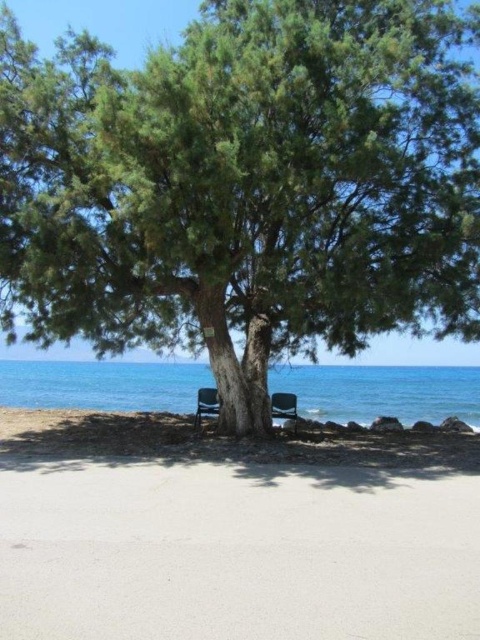
You are standing on the beach and see the green textured tree at center. If you walk 10 meters north, will you still be able to see the tree?

Yes, because the green textured tree at center is located at point (244, 186), which is in the central part of the scene, so walking north would keep it within your field of view.